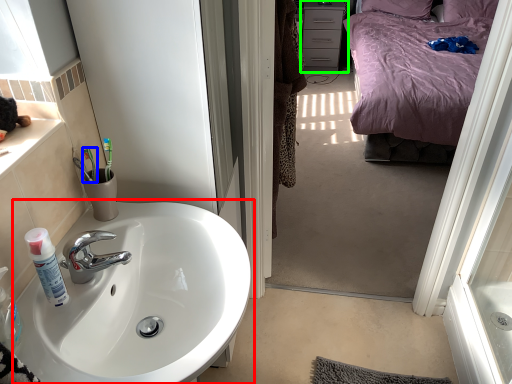
Question: Considering the real-world distances, which object is farthest from sink (highlighted by a red box)? toothbrush (highlighted by a blue box) or cabinetry (highlighted by a green box)?

Choices:
 (A) toothbrush
 (B) cabinetry

Answer: (B)